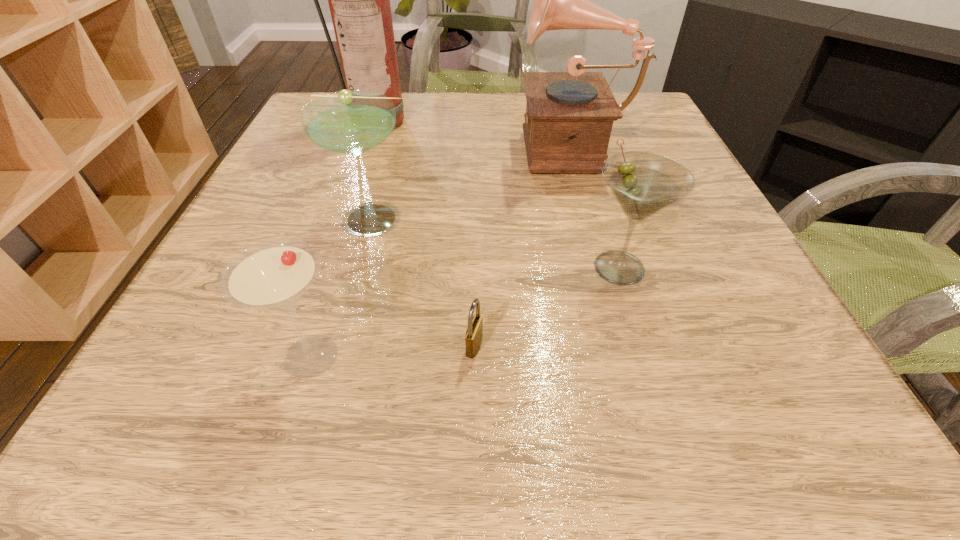
Where is `martini that is at the right edge`? martini that is at the right edge is located at coordinates (643, 183).

The image size is (960, 540). I want to click on object that is positioned at the far left corner, so click(359, 0).

Where is `object situated at the near left corner`? object situated at the near left corner is located at coordinates (274, 275).

Image resolution: width=960 pixels, height=540 pixels. What are the coordinates of `object that is at the far right corner` in the screenshot? It's located at (569, 116).

Locate an element on the screen. The image size is (960, 540). free point at the far edge is located at coordinates (475, 92).

This screenshot has height=540, width=960. Find the location of `free space at the near edge of the desktop`. free space at the near edge of the desktop is located at coordinates (484, 406).

Image resolution: width=960 pixels, height=540 pixels. Identify the location of vacant area at the left edge of the desktop. (341, 185).

The width and height of the screenshot is (960, 540). Identify the location of vacant space at the right edge of the desktop. (756, 288).

You are a GUI agent. You are given a task and a screenshot of the screen. Output one action in this format:
    pyautogui.click(x=<x>, y=<y>)
    Task: Click on the free space at the far right corner of the desktop
    The image size is (960, 540).
    Given the screenshot: What is the action you would take?
    pyautogui.click(x=650, y=105)

This screenshot has height=540, width=960. In order to click on free space at the near right corner of the desktop in this screenshot , I will do `click(829, 404)`.